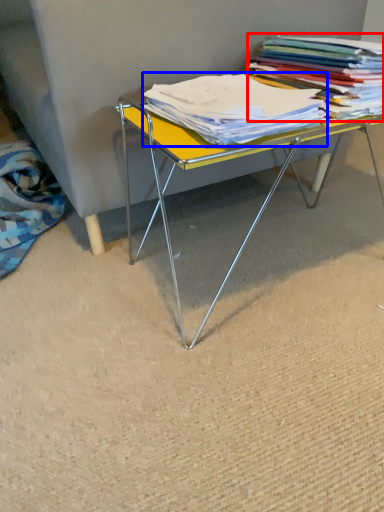
Question: Which of the following is the closest to the observer, book (highlighted by a red box) or magazine (highlighted by a blue box)?

Choices:
 (A) book
 (B) magazine

Answer: (B)